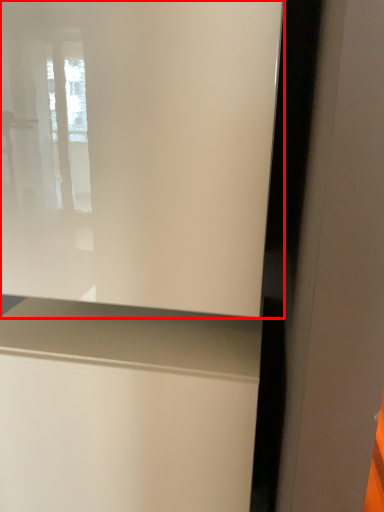
Question: From the image's perspective, what is the correct spatial relationship of window (annotated by the red box) in relation to vanity?

Choices:
 (A) below
 (B) above

Answer: (B)